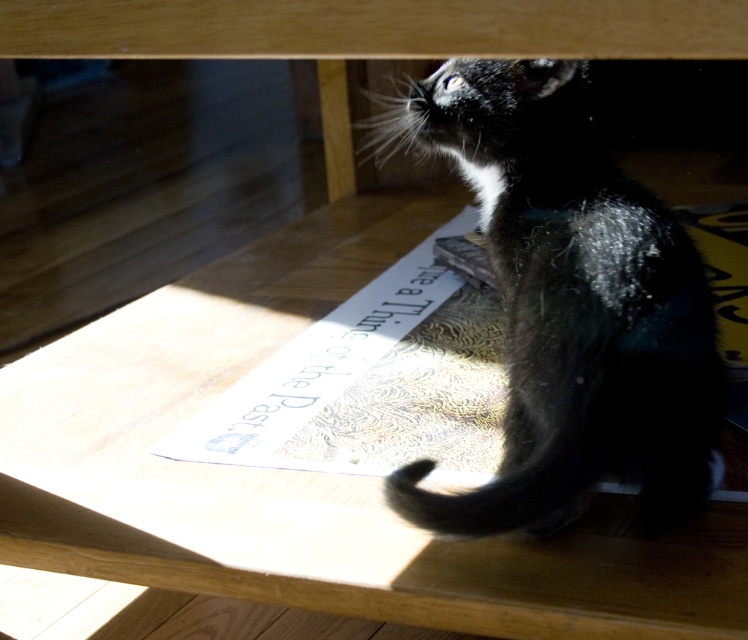
Between wooden table at center and black fur cat at lower right, which one appears on the left side from the viewer's perspective?

From the viewer's perspective, wooden table at center appears more on the left side.

Who is more distant from viewer, (656, 589) or (533, 400)?

Point (533, 400)

In order to click on wooden table at center in this screenshot , I will do `click(307, 472)`.